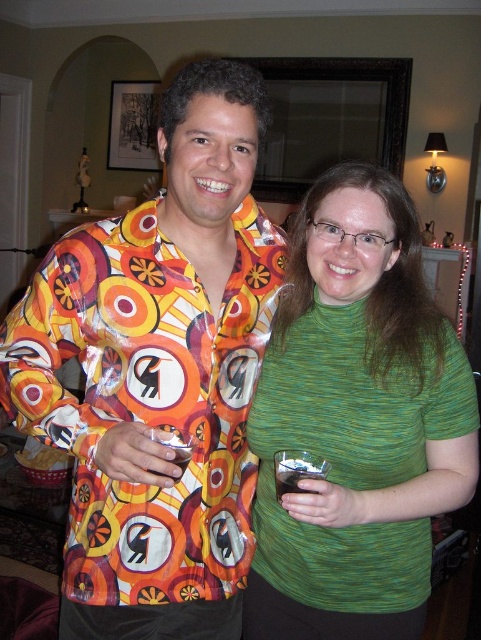
Can you confirm if green knit turtleneck at center is taller than transparent plastic wine glass at center?

Correct, green knit turtleneck at center is much taller as transparent plastic wine glass at center.

The height and width of the screenshot is (640, 481). Describe the element at coordinates (356, 420) in the screenshot. I see `green knit turtleneck at center` at that location.

Is point (347, 612) less distant than point (187, 465)?

No.

Locate an element on the screen. This screenshot has height=640, width=481. green knit turtleneck at center is located at coordinates (356, 420).

Does transparent plastic wine glass at lower center appear under transparent plastic wine glass at center?

Yes.

Is transparent plastic wine glass at lower center wider than transparent plastic wine glass at center?

Yes, transparent plastic wine glass at lower center is wider than transparent plastic wine glass at center.

Does point (281, 490) come farther from viewer compared to point (161, 435)?

Yes, point (281, 490) is farther from viewer.

This screenshot has height=640, width=481. I want to click on transparent plastic wine glass at lower center, so click(x=296, y=470).

Between green knit turtleneck at center and transparent plastic wine glass at lower center, which one appears on the left side from the viewer's perspective?

Positioned to the left is transparent plastic wine glass at lower center.

Which is above, green knit turtleneck at center or transparent plastic wine glass at lower center?

green knit turtleneck at center is above.

This screenshot has width=481, height=640. I want to click on green knit turtleneck at center, so click(356, 420).

Where is `green knit turtleneck at center`? The width and height of the screenshot is (481, 640). green knit turtleneck at center is located at coordinates (356, 420).